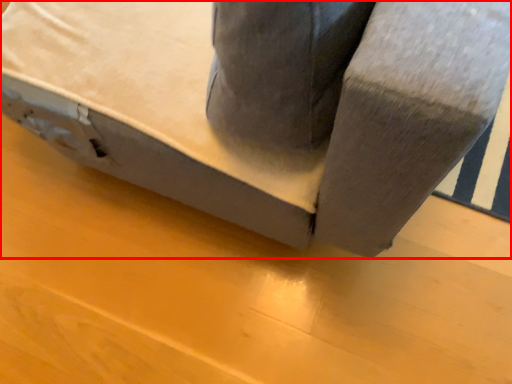
Question: In this image, where is furniture (annotated by the red box) located relative to plywood?

Choices:
 (A) right
 (B) left

Answer: (A)